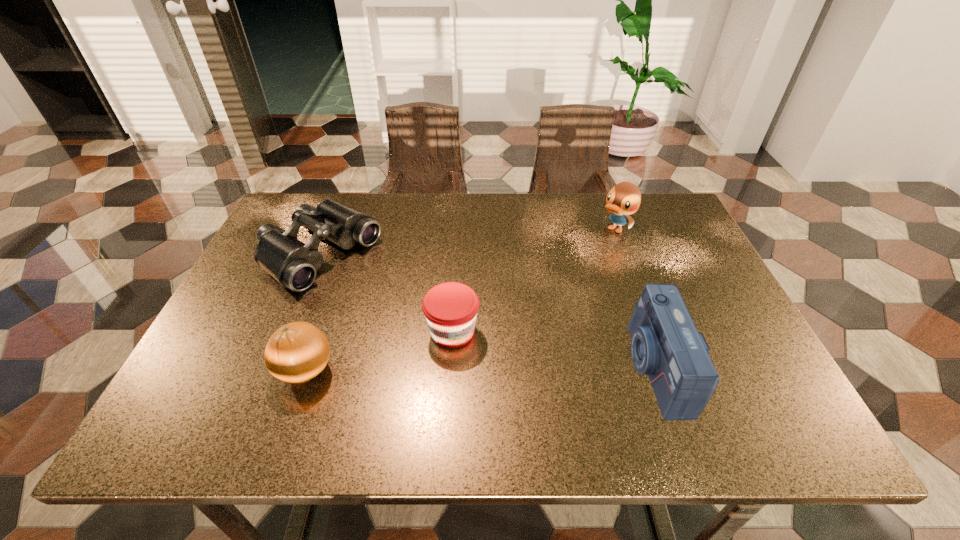
Locate an element on the screen. orange is located at coordinates (297, 352).

Find the location of `camera`. camera is located at coordinates (665, 344).

The width and height of the screenshot is (960, 540). I want to click on binoculars, so click(292, 263).

Locate an element on the screen. The image size is (960, 540). the third object from right to left is located at coordinates tap(450, 308).

You are a GUI agent. You are given a task and a screenshot of the screen. Output one action in this format:
    pyautogui.click(x=<x>, y=<y>)
    Task: Click on the shortest object
    
    Given the screenshot: What is the action you would take?
    pyautogui.click(x=450, y=308)

The image size is (960, 540). I want to click on duck, so click(624, 198).

Locate an element on the screen. vacant area situated 0.160m on the left of the orange is located at coordinates (201, 370).

The width and height of the screenshot is (960, 540). What are the coordinates of `vacant space located on the lens of the camera` in the screenshot? It's located at 473,367.

The height and width of the screenshot is (540, 960). In order to click on vacant space situated 0.180m on the lens of the camera in this screenshot , I will do coord(548,367).

This screenshot has width=960, height=540. In order to click on vacant space positioned on the lens of the camera in this screenshot , I will do `click(609, 367)`.